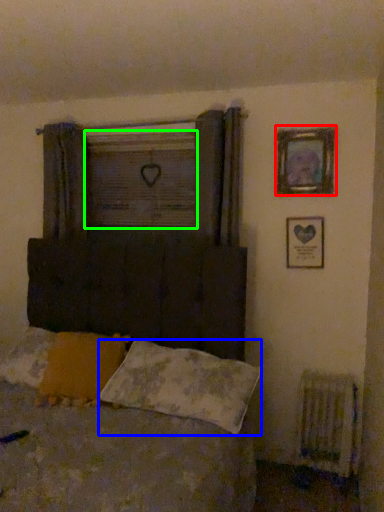
Question: Which is farther away from picture frame (highlighted by a red box)? pillow (highlighted by a blue box) or window screen (highlighted by a green box)?

Choices:
 (A) pillow
 (B) window screen

Answer: (A)